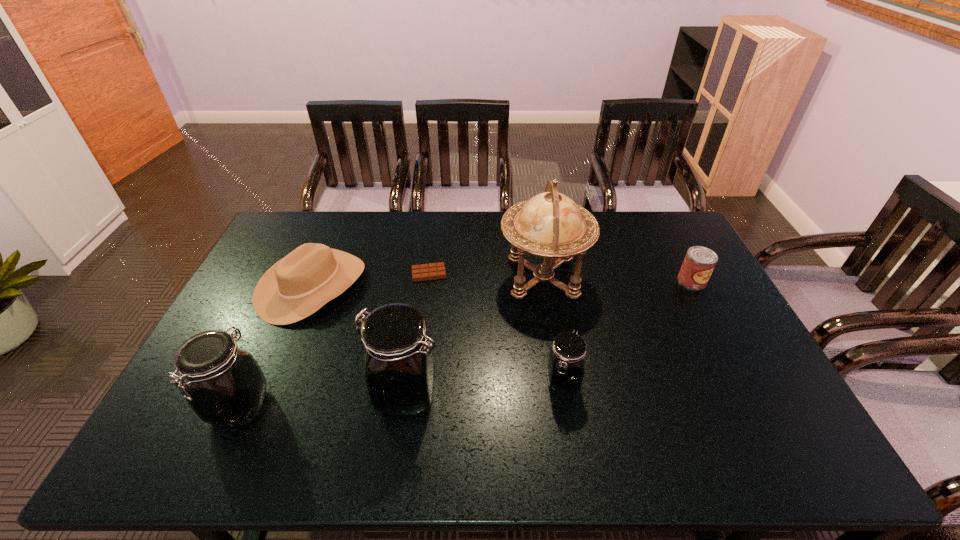
What are the coordinates of `free space located 0.060m on the lid of the second jar from left to right` in the screenshot? It's located at (346, 394).

At what (x,y) coordinates should I click in order to perform the action: click on free space located on the lid of the second jar from left to right. Please return your answer as a coordinate pair (x, y). The image size is (960, 540). Looking at the image, I should click on (241, 394).

Find the location of a particular element. This screenshot has height=540, width=960. vacant region located 0.050m on the lid of the shortest jar is located at coordinates (568, 416).

Find the location of a particular element. The height and width of the screenshot is (540, 960). vacant space located 0.140m on the front-facing side of the tallest object is located at coordinates (457, 278).

Where is `vacant space situated on the front-facing side of the tallest object`? The width and height of the screenshot is (960, 540). vacant space situated on the front-facing side of the tallest object is located at coordinates pyautogui.click(x=423, y=278).

You are a GUI agent. You are given a task and a screenshot of the screen. Output one action in this format:
    pyautogui.click(x=<x>, y=<y>)
    Task: Click on the vacant point located 0.340m on the front-facing side of the tallest object
    The image size is (960, 540).
    Given the screenshot: What is the action you would take?
    pyautogui.click(x=396, y=278)

Identify the location of free space located 0.120m on the right of the candy bar. (482, 273).

At what (x,y) coordinates should I click in order to perform the action: click on free space located on the front of the cowboy hat. Please return your answer as a coordinate pair (x, y). Looking at the image, I should click on (273, 381).

I want to click on vacant space located on the front of the can, so click(728, 349).

Where is `jar located at the left edge`? This screenshot has width=960, height=540. jar located at the left edge is located at coordinates (224, 385).